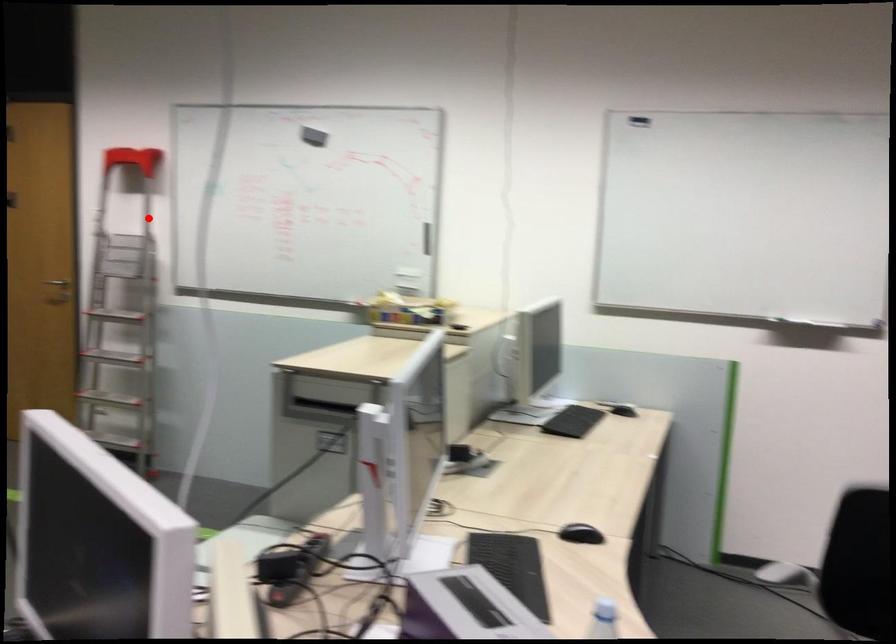
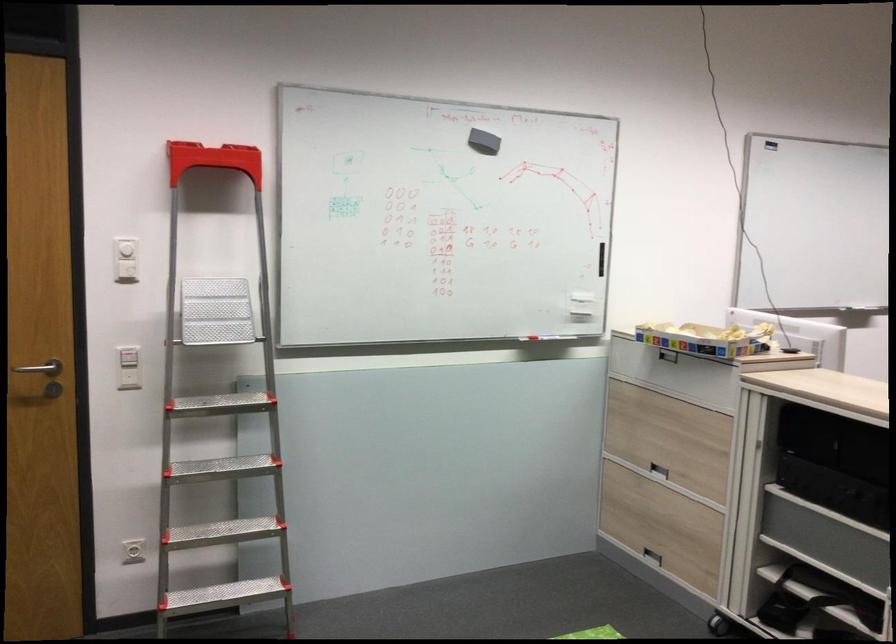
Question: A red point is marked in image1. In image2, is the corresponding 3D point closer to the camera or farther? Reply with the corresponding letter.

Choices:
 (A) The corresponding 3D point is closer.
 (B) The corresponding 3D point is farther.

Answer: (A)